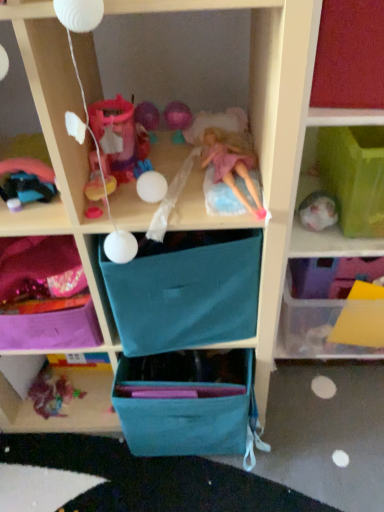
The height and width of the screenshot is (512, 384). What are the coordinates of `vacant space in front of teal fabric drawer at lower center, which is counted as the 1th drawer, starting from the bottom` in the screenshot? It's located at (192, 485).